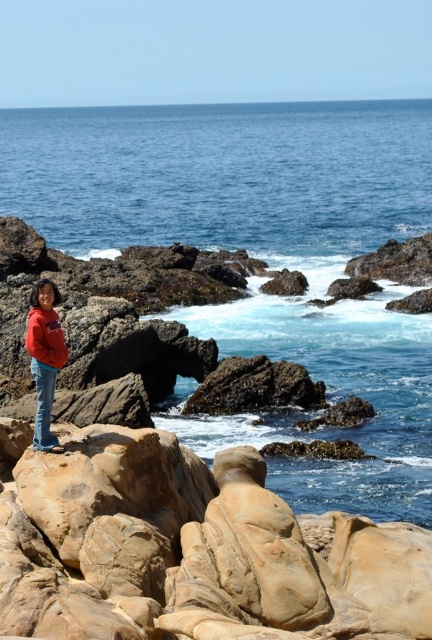
Question: Observing the image, what is the correct spatial positioning of blue smooth water at center in reference to matte red jacket at lower left?

Choices:
 (A) below
 (B) above

Answer: (B)

Question: Can you confirm if matte red hoodie at center is bigger than matte red jacket at lower left?

Choices:
 (A) no
 (B) yes

Answer: (B)

Question: Estimate the real-world distances between objects in this image. Which object is closer to the blue smooth water at center?

Choices:
 (A) matte red hoodie at center
 (B) matte red jacket at lower left

Answer: (A)

Question: Considering the relative positions of blue smooth water at center and matte red jacket at lower left in the image provided, where is blue smooth water at center located with respect to matte red jacket at lower left?

Choices:
 (A) left
 (B) right

Answer: (B)

Question: Considering the real-world distances, which object is farthest from the blue smooth water at center?

Choices:
 (A) matte red hoodie at center
 (B) matte red jacket at lower left

Answer: (B)

Question: Which object appears closest to the camera in this image?

Choices:
 (A) matte red hoodie at center
 (B) matte red jacket at lower left

Answer: (A)